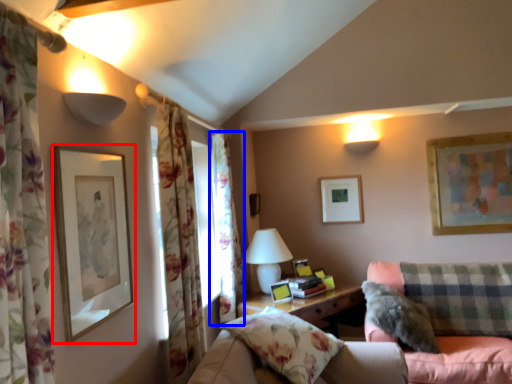
Question: Among these objects, which one is nearest to the camera, picture frame (highlighted by a red box) or curtain (highlighted by a blue box)?

Choices:
 (A) picture frame
 (B) curtain

Answer: (A)